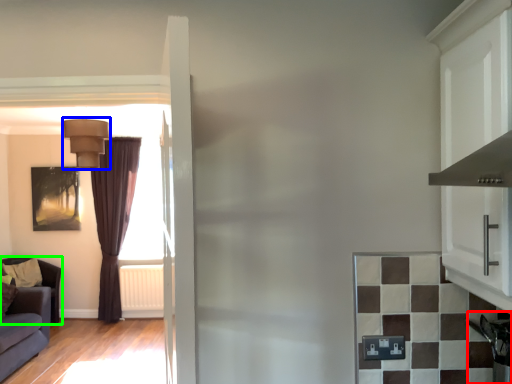
Question: Which is nearer to the appliance (highlighted by a red box)? light fixture (highlighted by a blue box) or furniture (highlighted by a green box).

Choices:
 (A) light fixture
 (B) furniture

Answer: (A)